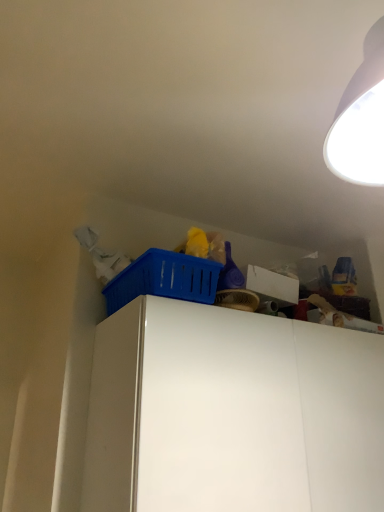
This screenshot has width=384, height=512. What do you see at coordinates (232, 413) in the screenshot?
I see `white matte cabinet at upper right` at bounding box center [232, 413].

The width and height of the screenshot is (384, 512). I want to click on white matte cabinet at upper right, so click(x=232, y=413).

What is the approximate height of blue plastic basket at upper center?

The height of blue plastic basket at upper center is 4.21 inches.

The width and height of the screenshot is (384, 512). What do you see at coordinates (164, 279) in the screenshot?
I see `blue plastic basket at upper center` at bounding box center [164, 279].

The image size is (384, 512). In order to click on blue plastic basket at upper center in this screenshot , I will do `click(164, 279)`.

Image resolution: width=384 pixels, height=512 pixels. Identify the location of white matte cabinet at upper right. (232, 413).

Between white matte cabinet at upper right and blue plastic basket at upper center, which one appears on the right side from the viewer's perspective?

white matte cabinet at upper right.

Which object is further away from the camera taking this photo, white matte cabinet at upper right or blue plastic basket at upper center?

Positioned behind is blue plastic basket at upper center.

Considering the positions of points (143, 420) and (110, 314), is point (143, 420) farther from camera compared to point (110, 314)?

No.

From the image's perspective, which one is positioned higher, white matte cabinet at upper right or blue plastic basket at upper center?

blue plastic basket at upper center.

From a real-world perspective, relative to blue plastic basket at upper center, is white matte cabinet at upper right vertically above or below?

Clearly, from a real-world perspective, white matte cabinet at upper right is below blue plastic basket at upper center.

Which object is thinner, white matte cabinet at upper right or blue plastic basket at upper center?

blue plastic basket at upper center.

Does white matte cabinet at upper right have a lesser height compared to blue plastic basket at upper center?

No, white matte cabinet at upper right is not shorter than blue plastic basket at upper center.

Based on the photo, considering the sizes of white matte cabinet at upper right and blue plastic basket at upper center in the image, is white matte cabinet at upper right bigger or smaller than blue plastic basket at upper center?

Clearly, white matte cabinet at upper right is larger in size than blue plastic basket at upper center.

Is white matte cabinet at upper right not inside blue plastic basket at upper center?

That's correct, white matte cabinet at upper right is outside of blue plastic basket at upper center.

Is white matte cabinet at upper right positioned far away from blue plastic basket at upper center?

No, white matte cabinet at upper right is not far from blue plastic basket at upper center.

Is white matte cabinet at upper right facing away from blue plastic basket at upper center?

white matte cabinet at upper right is not turned away from blue plastic basket at upper center.

How far apart are white matte cabinet at upper right and blue plastic basket at upper center?

The distance of white matte cabinet at upper right from blue plastic basket at upper center is 9.90 inches.

Find the location of a particular element. basket behind the white matte cabinet at upper right is located at coordinates (164, 279).

Would you say blue plastic basket at upper center is to the left or to the right of white matte cabinet at upper right in the picture?

blue plastic basket at upper center is positioned on white matte cabinet at upper right's left side.

Is the depth of blue plastic basket at upper center greater than that of white matte cabinet at upper right?

That is True.

Considering the points (163, 250) and (333, 414), which point is in front, point (163, 250) or point (333, 414)?

Point (163, 250)

In the scene shown: From the image's perspective, is blue plastic basket at upper center on top of white matte cabinet at upper right?

Yes, from the image's perspective, blue plastic basket at upper center is above white matte cabinet at upper right.

From a real-world perspective, which object stands above the other?

blue plastic basket at upper center, from a real-world perspective.

Does blue plastic basket at upper center have a greater width compared to white matte cabinet at upper right?

In fact, blue plastic basket at upper center might be narrower than white matte cabinet at upper right.

Looking at this image, does blue plastic basket at upper center have a greater height compared to white matte cabinet at upper right?

No, blue plastic basket at upper center is not taller than white matte cabinet at upper right.

Considering the relative sizes of blue plastic basket at upper center and white matte cabinet at upper right in the image provided, is blue plastic basket at upper center bigger than white matte cabinet at upper right?

Actually, blue plastic basket at upper center might be smaller than white matte cabinet at upper right.

Is blue plastic basket at upper center positioned beyond the bounds of white matte cabinet at upper right?

blue plastic basket at upper center is positioned outside white matte cabinet at upper right.

Is there a large distance between blue plastic basket at upper center and white matte cabinet at upper right?

No, blue plastic basket at upper center is not far away from white matte cabinet at upper right.

Is blue plastic basket at upper center positioned with its back to white matte cabinet at upper right?

No, blue plastic basket at upper center is not facing away from white matte cabinet at upper right.

Can you tell me how much blue plastic basket at upper center and white matte cabinet at upper right differ in facing direction?

1.8 degrees separate the facing orientations of blue plastic basket at upper center and white matte cabinet at upper right.

Measure the distance between blue plastic basket at upper center and white matte cabinet at upper right.

blue plastic basket at upper center is 9.90 inches away from white matte cabinet at upper right.

This screenshot has height=512, width=384. Find the location of `basket on the left of white matte cabinet at upper right`. basket on the left of white matte cabinet at upper right is located at coordinates click(164, 279).

Where is `cabinetry to the right of blue plastic basket at upper center`? The height and width of the screenshot is (512, 384). cabinetry to the right of blue plastic basket at upper center is located at coordinates (232, 413).

You are a GUI agent. You are given a task and a screenshot of the screen. Output one action in this format:
    pyautogui.click(x=<x>, y=<y>)
    Task: Click on the basket behind the white matte cabinet at upper right
    The image size is (384, 512).
    Given the screenshot: What is the action you would take?
    pyautogui.click(x=164, y=279)